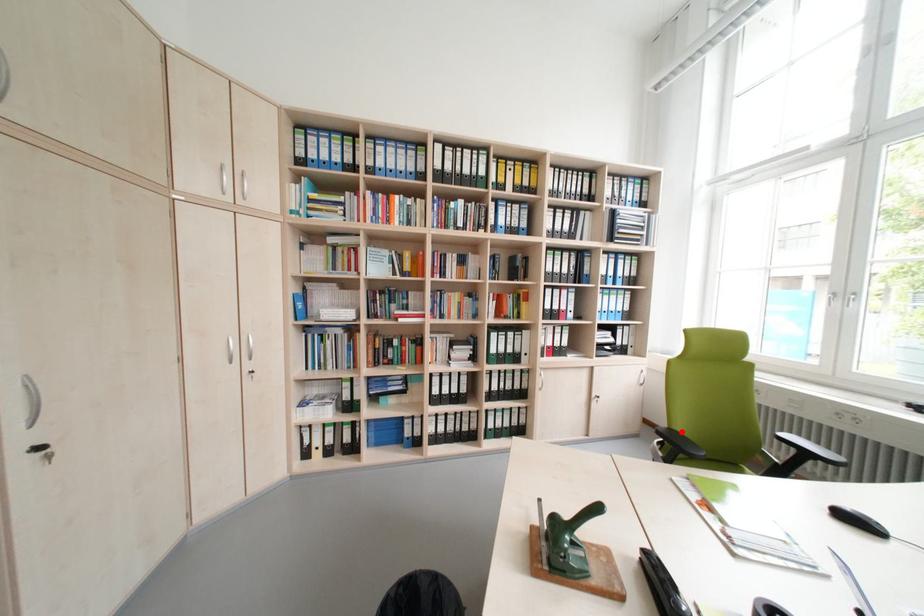
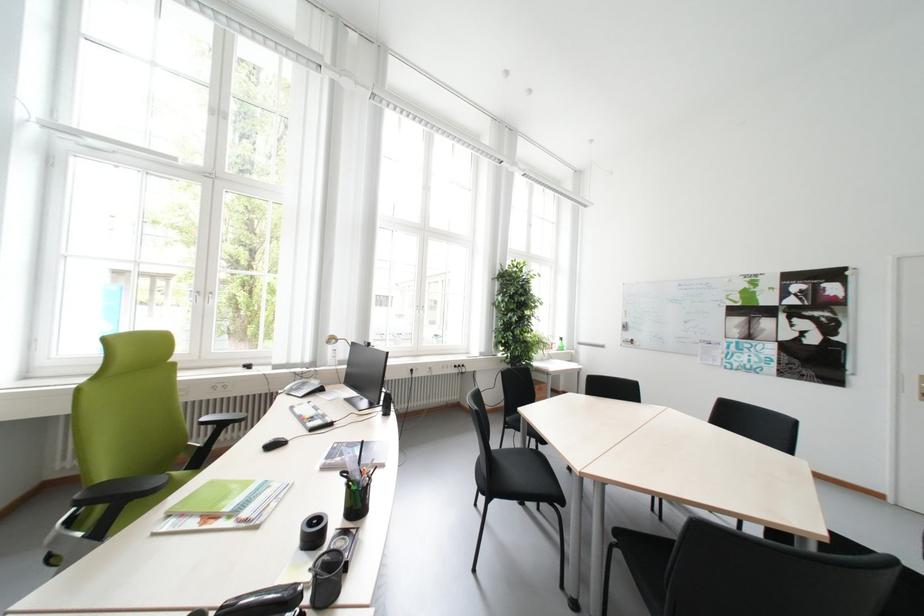
Locate, in the second image, the point that corresponds to the highlighted location in the first image.

(104, 488)